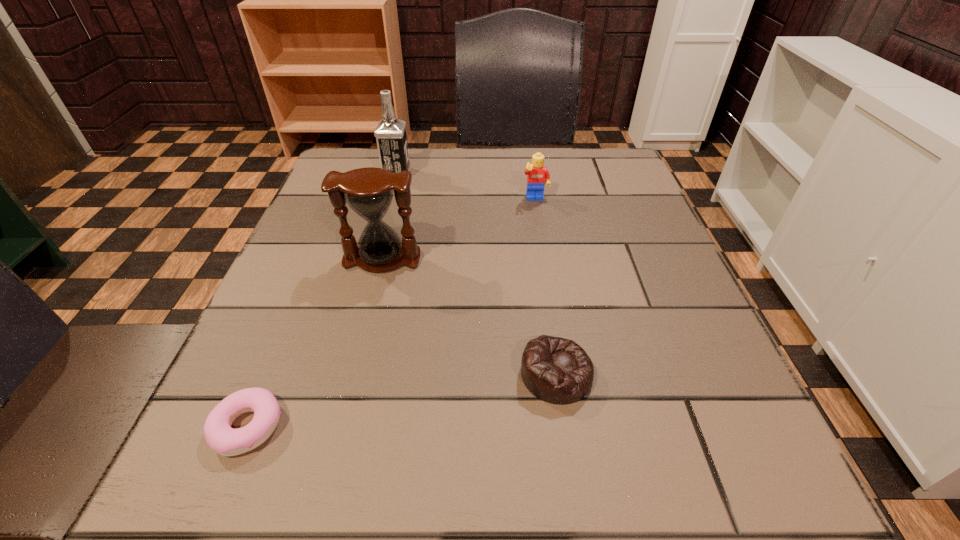
This screenshot has height=540, width=960. Find the location of `vodka`. vodka is located at coordinates (390, 133).

Where is `the third nearest object`? the third nearest object is located at coordinates point(369,192).

The image size is (960, 540). Find the location of `the third shortest object`. the third shortest object is located at coordinates (537, 173).

Where is `Lego`? The height and width of the screenshot is (540, 960). Lego is located at coordinates (537, 173).

At what (x,y) coordinates should I click in order to perform the action: click on the fourth tallest object. Please return your answer as a coordinate pair (x, y). Looking at the image, I should click on (556, 370).

The height and width of the screenshot is (540, 960). In order to click on the shortest object in this screenshot , I will do pos(226,441).

You are a GUI agent. You are given a task and a screenshot of the screen. Output one action in this format:
    pyautogui.click(x=<x>, y=<y>)
    Task: Click on the pastry
    Image resolution: width=960 pixels, height=540 pixels.
    Given the screenshot: What is the action you would take?
    pyautogui.click(x=226, y=441)

This screenshot has height=540, width=960. What are the coordinates of `free region located 0.100m on the front label of the farthest object` in the screenshot? It's located at (451, 174).

In order to click on vacant space located 0.270m on the back of the hourglass in this screenshot , I will do `click(403, 175)`.

Identify the location of free space located on the face of the third tallest object. (551, 293).